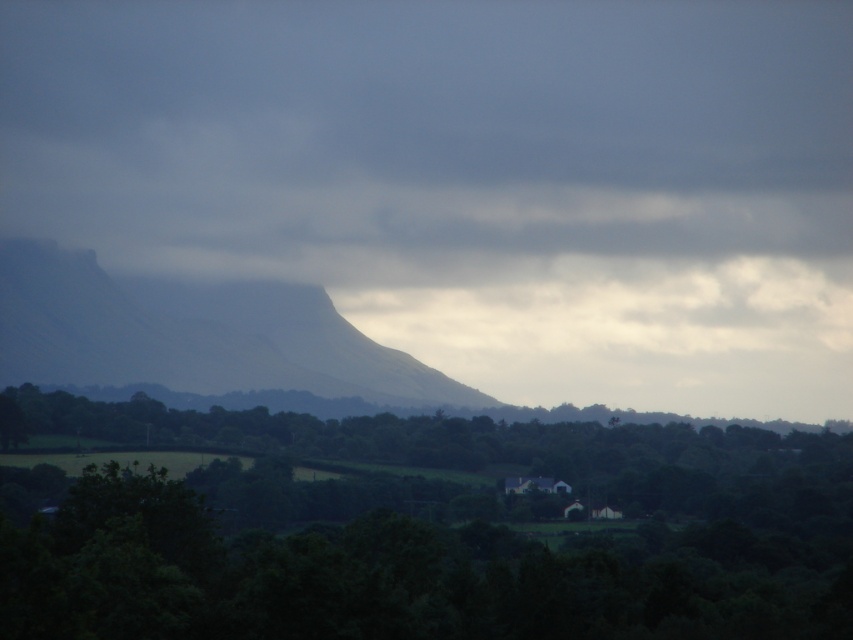
Between green leafy tree at center and gray foggy mountain at center, which one is positioned higher?

Positioned higher is gray foggy mountain at center.

Is point (399, 429) farther from camera compared to point (335, 358)?

No, it is in front of (335, 358).

The width and height of the screenshot is (853, 640). I want to click on green leafy tree at center, so click(x=444, y=541).

The image size is (853, 640). Identify the location of green leafy tree at center. (444, 541).